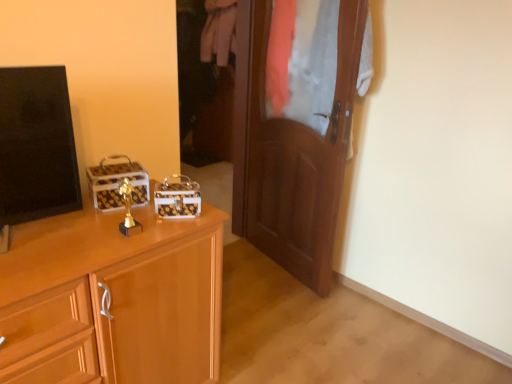
Identify the location of vacant position to the left of wooden door at center. point(247,268).